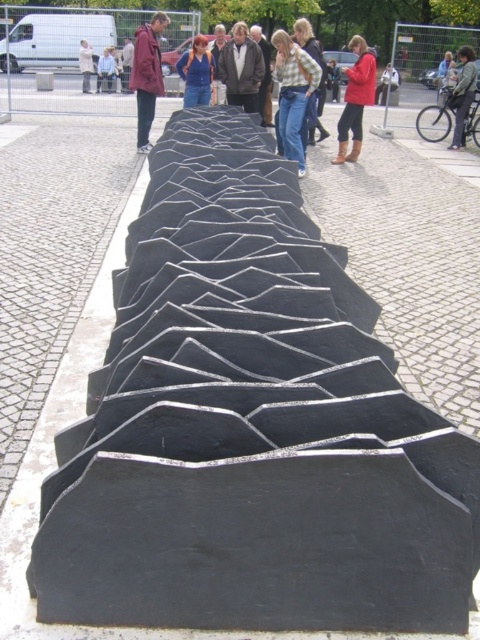
You are standing in front of the sculpture and notice two people wearing a matte blue shirt at center and a brown leather jacket at center. Which clothing item takes up more visual space in the scene?

The brown leather jacket at center takes up more visual space than the matte blue shirt at center because the matte blue shirt at center occupies less space than brown leather jacket at center.

You are standing in front of an outdoor sculpture and notice a person wearing a dark gray textured jacket at center and light blue jeans at center. Which clothing item is located to the right of the other?

The dark gray textured jacket at center is positioned on the right side of light blue jeans at center.